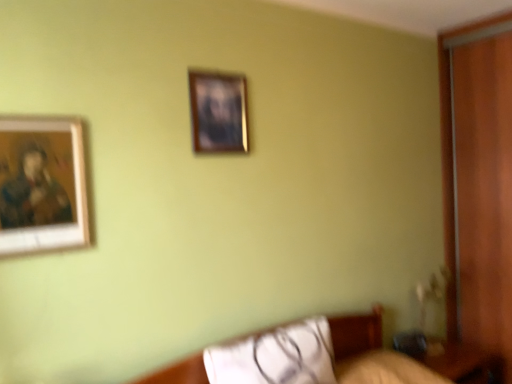
Question: Should I look upward or downward to see wooden-framed painting at left, which appears as the second picture frame when viewed from the right?

Choices:
 (A) up
 (B) down

Answer: (A)

Question: Is wooden table at lower right with wooden frame at upper center, which appears as the 1th picture frame when viewed from the right?

Choices:
 (A) no
 (B) yes

Answer: (A)

Question: Does wooden table at lower right have a greater height compared to wooden frame at upper center, marked as the 2th picture frame in a left-to-right arrangement?

Choices:
 (A) yes
 (B) no

Answer: (B)

Question: Is wooden table at lower right not near wooden frame at upper center, arranged as the first picture frame when viewed from the back?

Choices:
 (A) no
 (B) yes

Answer: (B)

Question: Does wooden table at lower right have a lesser height compared to wooden frame at upper center, arranged as the second picture frame when ordered from the bottom?

Choices:
 (A) yes
 (B) no

Answer: (A)

Question: Is wooden frame at upper center, the second picture frame from the front, surrounded by wooden table at lower right?

Choices:
 (A) yes
 (B) no

Answer: (B)

Question: Is wooden table at lower right further to the viewer compared to wooden frame at upper center, which is the first picture frame from top to bottom?

Choices:
 (A) no
 (B) yes

Answer: (B)

Question: Is wooden table at lower right not close to white fabric pillow at lower center?

Choices:
 (A) yes
 (B) no

Answer: (B)

Question: Could you tell me if wooden table at lower right is turned towards white fabric pillow at lower center?

Choices:
 (A) no
 (B) yes

Answer: (A)

Question: Considering the relative sizes of wooden table at lower right and white fabric pillow at lower center in the image provided, is wooden table at lower right smaller than white fabric pillow at lower center?

Choices:
 (A) yes
 (B) no

Answer: (B)

Question: From a real-world perspective, does wooden table at lower right sit lower than white fabric pillow at lower center?

Choices:
 (A) yes
 (B) no

Answer: (A)

Question: Considering the relative positions of wooden table at lower right and white fabric pillow at lower center in the image provided, is wooden table at lower right to the right of white fabric pillow at lower center from the viewer's perspective?

Choices:
 (A) yes
 (B) no

Answer: (A)

Question: Does wooden table at lower right have a greater width compared to white fabric pillow at lower center?

Choices:
 (A) no
 (B) yes

Answer: (B)

Question: Can you see white fabric pillow at lower center touching wooden frame at upper center, the second picture frame from the front?

Choices:
 (A) no
 (B) yes

Answer: (A)